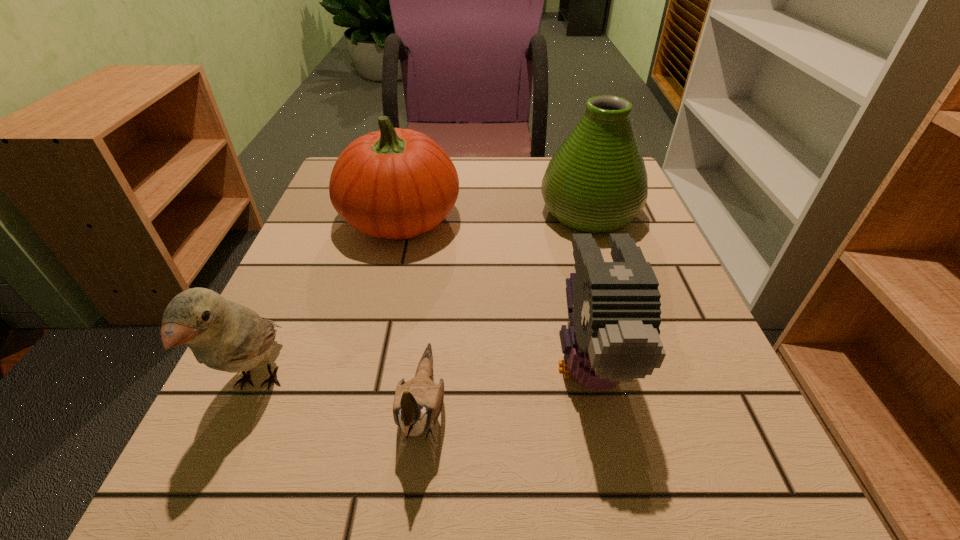
Where is `vase`? The width and height of the screenshot is (960, 540). vase is located at coordinates (596, 182).

Locate an element on the screen. This screenshot has height=540, width=960. pumpkin is located at coordinates (394, 183).

Where is `the rightmost bird`? The width and height of the screenshot is (960, 540). the rightmost bird is located at coordinates (614, 309).

Locate an element on the screen. the leftmost bird is located at coordinates (226, 336).

Find the location of a particular element. The image size is (960, 540). the second bird from right to left is located at coordinates (417, 404).

Identify the location of the shortest bird. This screenshot has width=960, height=540. (417, 404).

I want to click on vacant space situated on the front of the vase, so click(612, 283).

Find the location of a particular element. free space located 0.110m on the back of the pumpkin is located at coordinates (413, 165).

At what (x,y) coordinates should I click in order to perform the action: click on free location located at the beak of the rightmost bird. Please return your answer as a coordinate pair (x, y). Looking at the image, I should click on (612, 480).

Image resolution: width=960 pixels, height=540 pixels. Identify the location of free space located at the face of the leftmost bird. (215, 481).